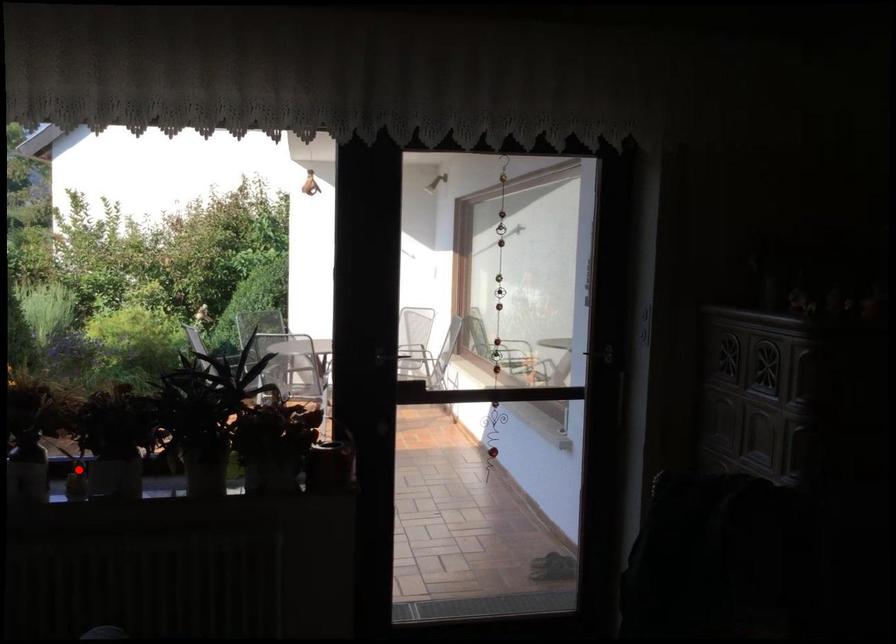
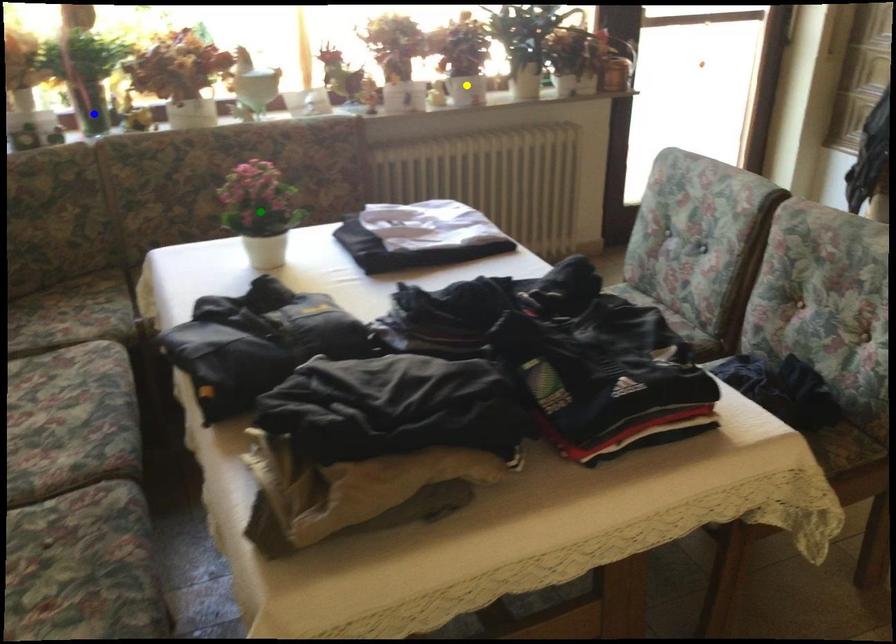
Question: I am providing you with two images of the same scene from different viewpoints. A red point is marked on the first image. You are given multiple points on the second image. In image 2, which mark is for the same physical point as the one in image 1?

Choices:
 (A) green point
 (B) yellow point
 (C) blue point

Answer: (B)